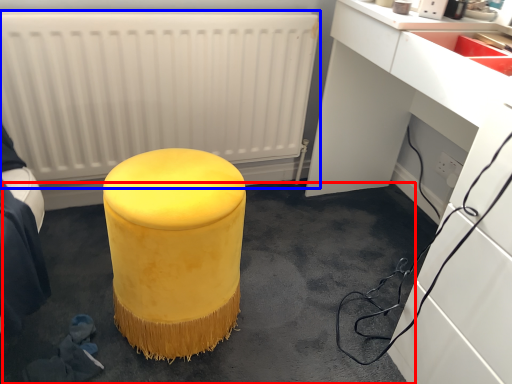
Question: Which object appears closest to the camera in this image, concrete (highlighted by a red box) or radiator (highlighted by a blue box)?

Choices:
 (A) concrete
 (B) radiator

Answer: (A)